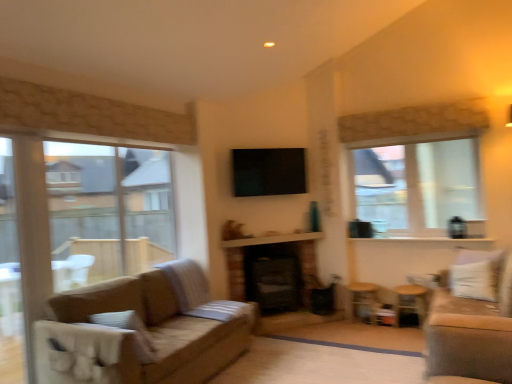
What is the approximate width of black glossy tv at center?

black glossy tv at center is 5.11 inches wide.

This screenshot has height=384, width=512. What do you see at coordinates (268, 172) in the screenshot?
I see `black glossy tv at center` at bounding box center [268, 172].

Measure the distance between point (233, 243) and camera.

Point (233, 243) and camera are 4.77 meters apart from each other.

What do you see at coordinates (280, 275) in the screenshot?
I see `black brick fireplace at center` at bounding box center [280, 275].

The height and width of the screenshot is (384, 512). What do you see at coordinates (362, 299) in the screenshot? I see `wooden side table at lower right, which is the second side table in right-to-left order` at bounding box center [362, 299].

What is the approximate width of clear glass window at left, which appears as the first window when viewed from the left?

It is 8.26 inches.

The image size is (512, 384). What do you see at coordinates (410, 301) in the screenshot?
I see `wooden side table at lower right, which appears as the first side table when viewed from the right` at bounding box center [410, 301].

You are a GUI agent. You are given a task and a screenshot of the screen. Output one action in this format:
    pyautogui.click(x=<x>, y=<y>)
    Task: Click on the clear glass window at upper right, the 1th window in the back-to-front sequence
    The width and height of the screenshot is (512, 384).
    Given the screenshot: What is the action you would take?
    pyautogui.click(x=417, y=186)

Where is `black glossy tv at center`? black glossy tv at center is located at coordinates (268, 172).

Which object is more forward, white textured balcony at center or velvet beige couch at right?

velvet beige couch at right.

Consider the image. From a real-world perspective, is white textured balcony at center positioned over velvet beige couch at right based on gravity?

Correct, in the physical world, white textured balcony at center is higher than velvet beige couch at right.

In the scene shown: Measure the distance between white textured balcony at center and velvet beige couch at right.

The distance of white textured balcony at center from velvet beige couch at right is 2.48 meters.

Considering the positions of point (231, 247) and point (430, 306), is point (231, 247) closer or farther from the camera than point (430, 306)?

Point (231, 247).

Which of these two, white textured balcony at center or black glossy tv at center, is bigger?

black glossy tv at center is bigger.

Locate an element on the screen. This screenshot has height=384, width=512. balcony located underneath the black glossy tv at center (from a real-world perspective) is located at coordinates (271, 239).

From a real-world perspective, is white textured balcony at center located beneath black glossy tv at center?

Correct, in the physical world, white textured balcony at center is lower than black glossy tv at center.

Is white textured balcony at center in front of black glossy tv at center?

Yes.

Considering the positions of points (287, 287) and (248, 239), is point (287, 287) farther from camera compared to point (248, 239)?

Yes, it is behind point (248, 239).

Could you tell me if black brick fireplace at center is turned towards white textured balcony at center?

No, black brick fireplace at center is not aimed at white textured balcony at center.

From a real-world perspective, is black brick fireplace at center physically above white textured balcony at center?

No.

You are a GUI agent. You are given a task and a screenshot of the screen. Output one action in this format:
    pyautogui.click(x=<x>, y=<y>)
    Task: Click on the fireplace behind the white textured balcony at center
    
    Given the screenshot: What is the action you would take?
    pyautogui.click(x=280, y=275)

Which point is more forward, (9, 182) or (286, 243)?

Point (9, 182)

Does clear glass window at left, the 1th window from the front, have a smaller size compared to black brick fireplace at center?

No, clear glass window at left, the 1th window from the front, is not smaller than black brick fireplace at center.

Is clear glass window at left, which appears as the first window when viewed from the left, positioned before black brick fireplace at center?

Yes, the depth of clear glass window at left, which appears as the first window when viewed from the left, is less than that of black brick fireplace at center.

Based on the photo, from a real-world perspective, is clear glass window at left, which appears as the first window when viewed from the left, physically located above or below black brick fireplace at center?

clear glass window at left, which appears as the first window when viewed from the left, is situated higher than black brick fireplace at center in the real world.

Does white textured balcony at center have a greater width compared to wooden side table at lower right, the 1th side table from the left?

No, white textured balcony at center is not wider than wooden side table at lower right, the 1th side table from the left.

Could you tell me if white textured balcony at center is facing wooden side table at lower right, which is the second side table in right-to-left order?

No, white textured balcony at center is not aimed at wooden side table at lower right, which is the second side table in right-to-left order.

Locate an element on the screen. The width and height of the screenshot is (512, 384). the 1st side table counting from the left side of the velvet beige couch at right is located at coordinates (410, 301).

Considering the positions of point (399, 290) and point (446, 344), is point (399, 290) closer or farther from the camera than point (446, 344)?

Point (399, 290) appears to be farther away from the viewer than point (446, 344).

Between wooden side table at lower right, which appears as the first side table when viewed from the right, and velvet beige couch at right, which one has larger width?

velvet beige couch at right.

Is wooden side table at lower right, the 2th side table viewed from the left, positioned far away from velvet beige couch at right?

wooden side table at lower right, the 2th side table viewed from the left, is positioned a significant distance from velvet beige couch at right.

Is wooden side table at lower right, which is the second side table in right-to-left order, positioned beyond the bounds of velvet beige couch at right?

wooden side table at lower right, which is the second side table in right-to-left order, lies outside velvet beige couch at right's area.

Is point (377, 291) closer to camera compared to point (446, 315)?

No, (377, 291) is behind (446, 315).

How different are the orientations of wooden side table at lower right, which is the second side table in right-to-left order, and velvet beige couch at right in degrees?

There is a 89.6-degree angle between the facing directions of wooden side table at lower right, which is the second side table in right-to-left order, and velvet beige couch at right.

Locate an element on the screen. This screenshot has width=512, height=384. studio couch located on the right of white textured balcony at center is located at coordinates (471, 335).

Locate an element on the screen. window screen to the left of white textured balcony at center is located at coordinates (268, 172).

Considering their positions, is velvet beige couch at right positioned closer to black brick fireplace at center than black glossy tv at center?

Based on the image, black glossy tv at center appears to be nearer to black brick fireplace at center.

Estimate the real-world distances between objects in this image. Which object is closer to clear glass window at left, the 1th window from the front, wooden side table at lower right, the 1th side table from the left, or wooden side table at lower right, the 2th side table viewed from the left?

wooden side table at lower right, the 1th side table from the left, is closer to clear glass window at left, the 1th window from the front.

Consider the image. Estimate the real-world distances between objects in this image. Which object is closer to wooden side table at lower right, which is the second side table in right-to-left order, black brick fireplace at center or black glossy tv at center?

black brick fireplace at center is positioned closer to the anchor wooden side table at lower right, which is the second side table in right-to-left order.

From the image, which object appears to be farther from black brick fireplace at center, wooden side table at lower right, which appears as the first side table when viewed from the right, or wooden side table at lower right, which is the second side table in right-to-left order?

wooden side table at lower right, which appears as the first side table when viewed from the right, lies further to black brick fireplace at center than the other object.

Based on their spatial positions, is white textured balcony at center or clear glass window at left, which appears as the first window when viewed from the left, further from black brick fireplace at center?

The object further to black brick fireplace at center is clear glass window at left, which appears as the first window when viewed from the left.

When comparing their distances from clear glass window at left, the 1th window from the front, does wooden side table at lower right, which appears as the first side table when viewed from the right, or black glossy tv at center seem closer?

Based on the image, black glossy tv at center appears to be nearer to clear glass window at left, the 1th window from the front.

Which object lies nearer to the anchor point wooden side table at lower right, the 1th side table from the left, velvet beige couch at right or wooden side table at lower right, the 2th side table viewed from the left?

wooden side table at lower right, the 2th side table viewed from the left, is closer to wooden side table at lower right, the 1th side table from the left.

Consider the image. Considering their positions, is black glossy tv at center positioned closer to wooden side table at lower right, which appears as the first side table when viewed from the right, than wooden side table at lower right, the 1th side table from the left?

Among the two, wooden side table at lower right, the 1th side table from the left, is located nearer to wooden side table at lower right, which appears as the first side table when viewed from the right.

Locate an element on the screen. The height and width of the screenshot is (384, 512). fireplace situated between clear glass window at left, acting as the second window starting from the back, and wooden side table at lower right, the 2th side table viewed from the left, from left to right is located at coordinates (280, 275).

Locate an element on the screen. window screen between black brick fireplace at center and velvet beige couch at right in the horizontal direction is located at coordinates click(x=268, y=172).

Locate an element on the screen. The image size is (512, 384). balcony between black glossy tv at center and wooden side table at lower right, the 2th side table viewed from the left, in the horizontal direction is located at coordinates (271, 239).

Where is `fireplace between clear glass window at left, which is counted as the second window, starting from the right, and clear glass window at upper right, the 1th window in the back-to-front sequence, from left to right`? This screenshot has width=512, height=384. fireplace between clear glass window at left, which is counted as the second window, starting from the right, and clear glass window at upper right, the 1th window in the back-to-front sequence, from left to right is located at coordinates (280, 275).